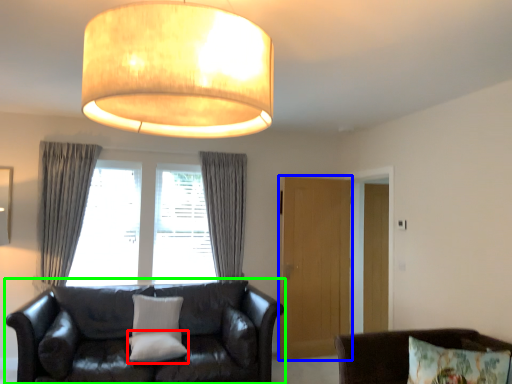
Question: Which object is the closest to the pillow (highlighted by a red box)? Choose among these: glass door (highlighted by a blue box) or studio couch (highlighted by a green box).

Choices:
 (A) glass door
 (B) studio couch

Answer: (B)